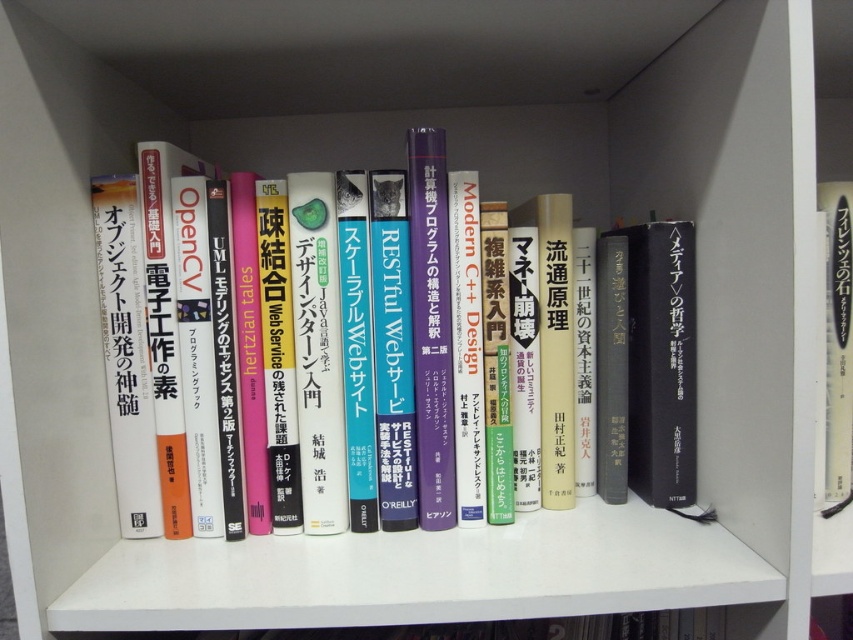
Can you confirm if hardcover book at center is positioned above white paper book at right?

No, hardcover book at center is not above white paper book at right.

Does point (219, 388) come closer to viewer compared to point (827, 513)?

That is True.

The image size is (853, 640). Identify the location of hardcover book at center. (181, 353).